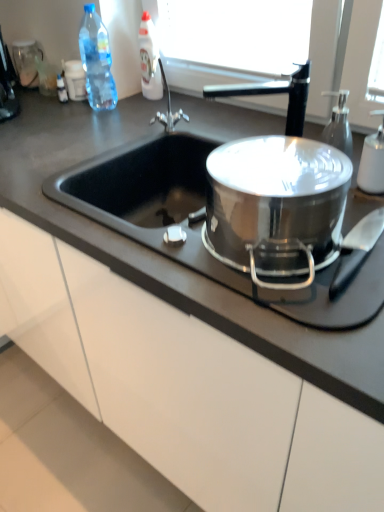
Identify the location of unoccupied area in front of white glossy bottle at upper center, acting as the first bottle starting from the back. This screenshot has height=512, width=384. (164, 109).